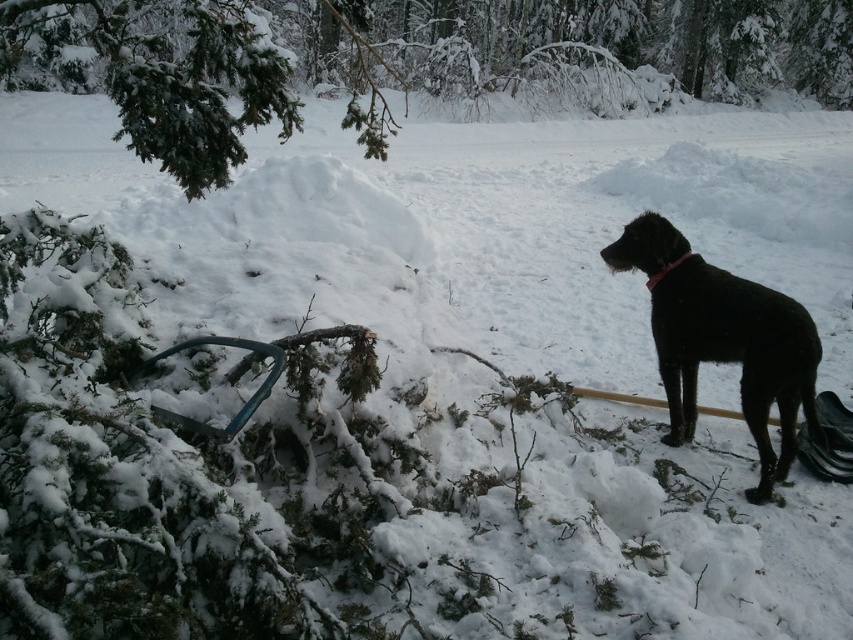
You are a hiker in the forest and want to take a photo of the green textured pine at upper left and the black matte dog at right. Which object should you focus on first if you want both to be in clear focus?

The green textured pine at upper left is taller than the black matte dog at right, so you should focus on the green textured pine at upper left first to ensure both are in clear focus.

You are standing in the snowy forest and see the green textured pine at upper left and the black matte dog at right. Which object is nearer to you?

The green textured pine at upper left is closer to the viewer than the black matte dog at right.